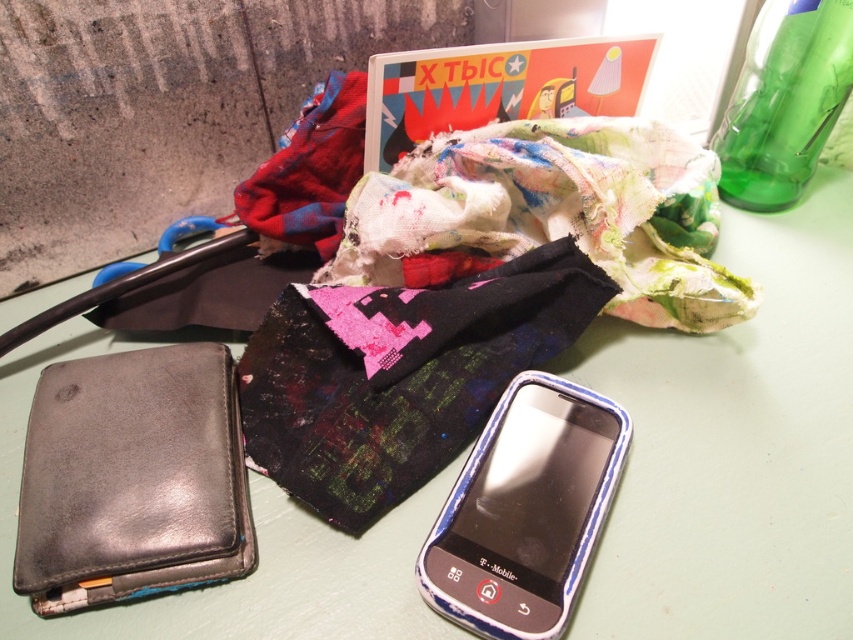
You are organizing items on a desk and need to place a new item between the dark green fabric at center and the blue plastic phone at lower right. Based on their positions, where should you place the new item to ensure it is between them?

The dark green fabric at center is closer to you than the blue plastic phone at lower right. To place the new item between them, position it closer to the dark green fabric at center but still in front of the blue plastic phone at lower right.

You are organizing items on a light green surface. There is a black leather wallet on the left and a small rectangular mobile phone with a blue and white protective case to its right. Next to the phone, there is a pile of fabric scraps and pieces of clothing, including a dark green fabric at center represented by point [399,374]. Where is the dark green fabric at center located relative to the black leather wallet on the left and the small rectangular mobile phone with a blue and white protective case?

The dark green fabric at center represented by point [399,374] is located between the black leather wallet on the left and the small rectangular mobile phone with a blue and white protective case.

You are organizing a sewing project and need to know which fabric piece is taller between the dark green fabric at center and the red fabric at upper center. Based on the scene, which one is taller?

→ The dark green fabric at center is much taller than the red fabric at upper center according to the description.